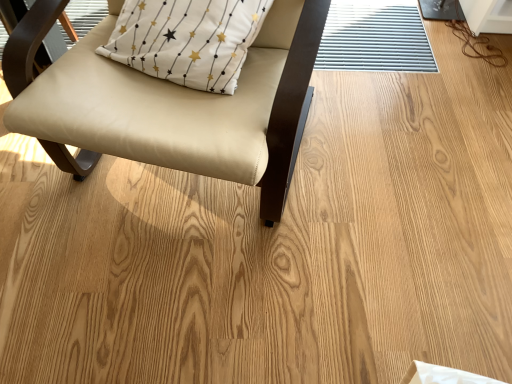
Question: Are white fabric pillow at upper left and beige leather chair at upper left making contact?

Choices:
 (A) no
 (B) yes

Answer: (A)

Question: Is white fabric pillow at upper left turned away from beige leather chair at upper left?

Choices:
 (A) no
 (B) yes

Answer: (B)

Question: Is white fabric pillow at upper left thinner than beige leather chair at upper left?

Choices:
 (A) no
 (B) yes

Answer: (B)

Question: Considering the relative sizes of white fabric pillow at upper left and beige leather chair at upper left in the image provided, is white fabric pillow at upper left bigger than beige leather chair at upper left?

Choices:
 (A) yes
 (B) no

Answer: (B)

Question: Is the depth of white fabric pillow at upper left greater than that of beige leather chair at upper left?

Choices:
 (A) yes
 (B) no

Answer: (A)

Question: Can you confirm if white fabric pillow at upper left is shorter than beige leather chair at upper left?

Choices:
 (A) no
 (B) yes

Answer: (B)

Question: Is beige leather chair at upper left not near white fabric pillow at upper left?

Choices:
 (A) yes
 (B) no

Answer: (B)

Question: From a real-world perspective, is beige leather chair at upper left on white fabric pillow at upper left?

Choices:
 (A) yes
 (B) no

Answer: (B)

Question: Can you confirm if beige leather chair at upper left is shorter than white fabric pillow at upper left?

Choices:
 (A) yes
 (B) no

Answer: (B)

Question: Is white fabric pillow at upper left at the back of beige leather chair at upper left?

Choices:
 (A) yes
 (B) no

Answer: (A)

Question: Does beige leather chair at upper left have a larger size compared to white fabric pillow at upper left?

Choices:
 (A) yes
 (B) no

Answer: (A)

Question: Is beige leather chair at upper left located outside white fabric pillow at upper left?

Choices:
 (A) yes
 (B) no

Answer: (A)

Question: Considering the positions of white fabric pillow at upper left and beige leather chair at upper left in the image, is white fabric pillow at upper left bigger or smaller than beige leather chair at upper left?

Choices:
 (A) big
 (B) small

Answer: (B)